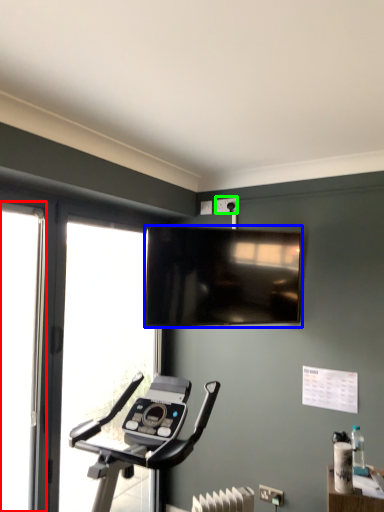
Question: Which is farther away from screen door (highlighted by a red box)? television (highlighted by a blue box) or electric outlet (highlighted by a green box)?

Choices:
 (A) television
 (B) electric outlet

Answer: (B)